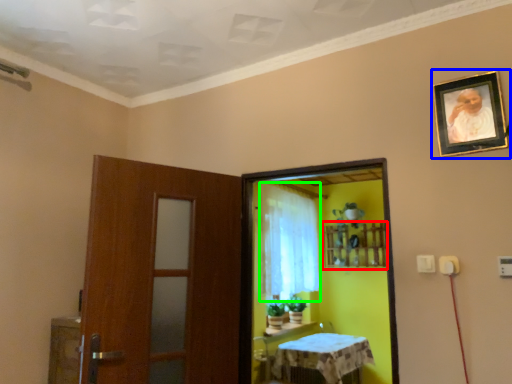
Question: Considering the real-world distances, which object is farthest from shelf (highlighted by a red box)? picture frame (highlighted by a blue box) or curtain (highlighted by a green box)?

Choices:
 (A) picture frame
 (B) curtain

Answer: (A)